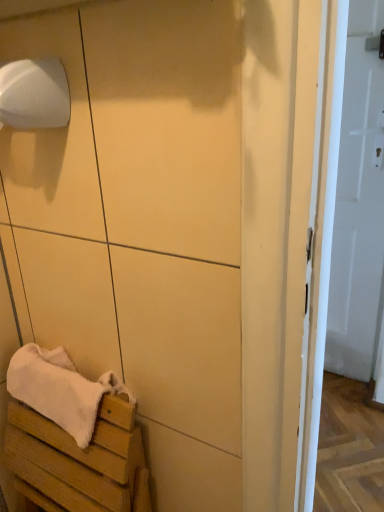
Question: Can you confirm if white matte toilet paper at upper left is positioned to the right of white glossy door at right?

Choices:
 (A) no
 (B) yes

Answer: (A)

Question: Would you say white glossy door at right is part of white matte toilet paper at upper left's contents?

Choices:
 (A) yes
 (B) no

Answer: (B)

Question: From a real-world perspective, is white matte toilet paper at upper left under white glossy door at right?

Choices:
 (A) no
 (B) yes

Answer: (A)

Question: Does white matte toilet paper at upper left have a larger size compared to white glossy door at right?

Choices:
 (A) no
 (B) yes

Answer: (A)

Question: From a real-world perspective, is white matte toilet paper at upper left physically above white glossy door at right?

Choices:
 (A) yes
 (B) no

Answer: (A)

Question: Considering their positions, is white matte toilet paper at upper left located in front of or behind white wood bench at lower left?

Choices:
 (A) front
 (B) behind

Answer: (A)

Question: Is white matte toilet paper at upper left wider or thinner than white wood bench at lower left?

Choices:
 (A) wide
 (B) thin

Answer: (B)

Question: From the image's perspective, is white matte toilet paper at upper left positioned above or below white wood bench at lower left?

Choices:
 (A) above
 (B) below

Answer: (A)

Question: From a real-world perspective, is white matte toilet paper at upper left positioned above or below white wood bench at lower left?

Choices:
 (A) above
 (B) below

Answer: (A)

Question: Is white soft towel at lower left taller or shorter than white matte toilet paper at upper left?

Choices:
 (A) tall
 (B) short

Answer: (A)

Question: Visually, is white soft towel at lower left positioned to the left or to the right of white matte toilet paper at upper left?

Choices:
 (A) left
 (B) right

Answer: (B)

Question: Is point (79, 384) closer or farther from the camera than point (57, 60)?

Choices:
 (A) farther
 (B) closer

Answer: (A)

Question: In the image, is white soft towel at lower left positioned in front of or behind white matte toilet paper at upper left?

Choices:
 (A) front
 (B) behind

Answer: (B)

Question: Considering the positions of point (51, 428) and point (362, 177), is point (51, 428) closer or farther from the camera than point (362, 177)?

Choices:
 (A) closer
 (B) farther

Answer: (A)

Question: In the image, is white wood bench at lower left positioned in front of or behind white glossy door at right?

Choices:
 (A) behind
 (B) front

Answer: (B)